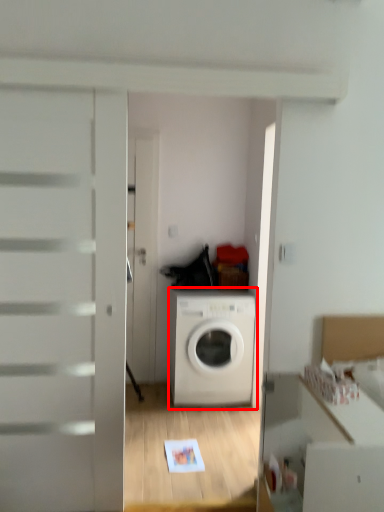
Question: From the image's perspective, what is the correct spatial positioning of washing machine (annotated by the red box) in reference to cabinetry?

Choices:
 (A) above
 (B) below

Answer: (A)